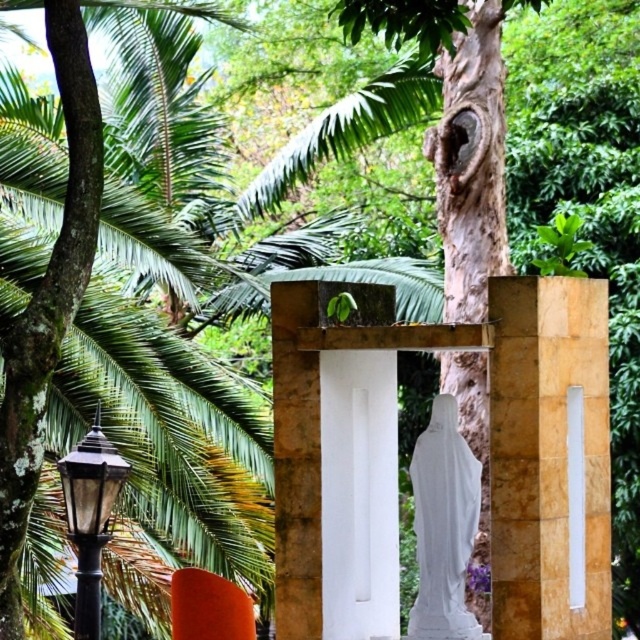
Between white marble statue at center and black glass lamp post at left, which one is positioned higher?

white marble statue at center is above.

Which is below, white marble statue at center or black glass lamp post at left?

black glass lamp post at left

The width and height of the screenshot is (640, 640). I want to click on white marble statue at center, so click(444, 525).